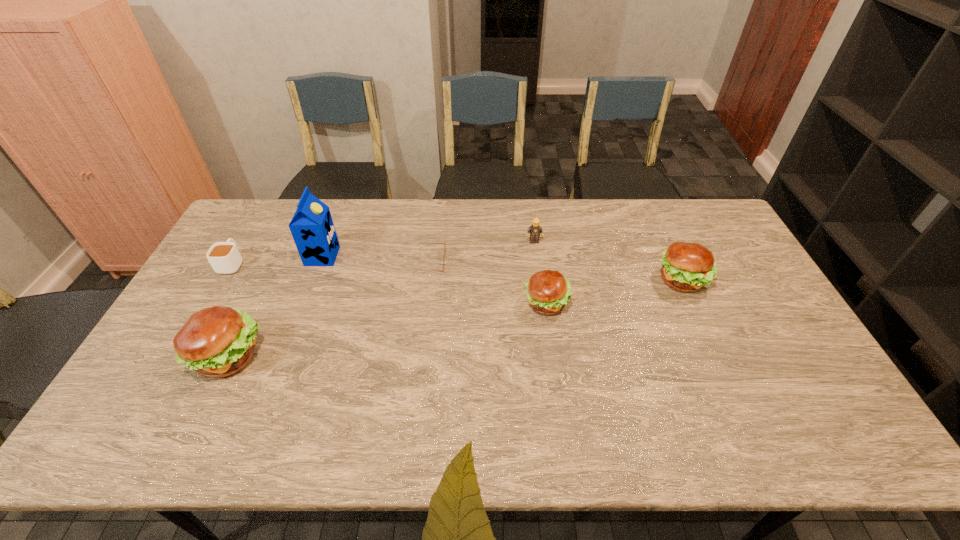
Identify the location of the fourth object from left to right. Image resolution: width=960 pixels, height=540 pixels. (419, 243).

At what (x,y) coordinates should I click in order to perform the action: click on the farthest object. Please return your answer as a coordinate pair (x, y). Looking at the image, I should click on (534, 230).

Where is `free location located 0.080m on the back of the nearest hamburger`? free location located 0.080m on the back of the nearest hamburger is located at coordinates (253, 307).

In order to click on vacant region located on the back of the second hamburger from left to right in this screenshot , I will do `click(538, 240)`.

What are the coordinates of `vacant area situated on the back of the rightmost object` in the screenshot? It's located at (646, 201).

Identify the location of vacant space located on the side with the handle of the leftmost object. This screenshot has height=540, width=960. (259, 217).

Find the location of a particular element. vacant space located 0.250m on the side with the handle of the leftmost object is located at coordinates (265, 207).

Where is `vacant space located 0.240m on the side with the handle of the leftmost object`? The height and width of the screenshot is (540, 960). vacant space located 0.240m on the side with the handle of the leftmost object is located at coordinates (264, 209).

You are a GUI agent. You are given a task and a screenshot of the screen. Output one action in this format:
    pyautogui.click(x=<x>, y=<y>)
    Task: Click on the free location located 0.110m with the cap open on the carton
    The image size is (960, 540).
    Given the screenshot: What is the action you would take?
    pyautogui.click(x=371, y=256)

In order to click on free space located 0.140m on the face of the shortest object in this screenshot , I will do `click(487, 261)`.